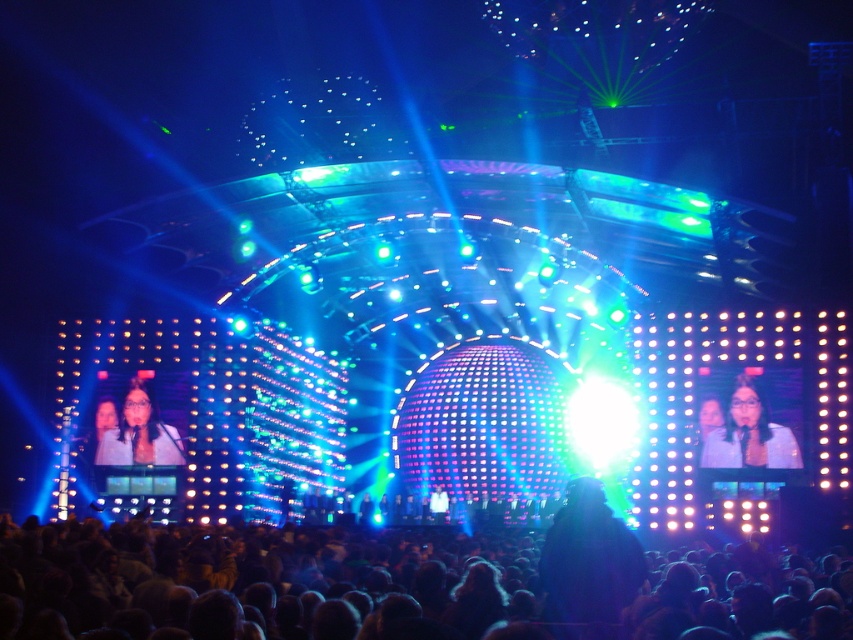
Does matte white shirt at right have a lesser width compared to matte white microphone at center?

Yes, matte white shirt at right is thinner than matte white microphone at center.

Can you confirm if matte white shirt at right is wider than matte white microphone at center?

In fact, matte white shirt at right might be narrower than matte white microphone at center.

You are a GUI agent. You are given a task and a screenshot of the screen. Output one action in this format:
    pyautogui.click(x=<x>, y=<y>)
    Task: Click on the matte white shirt at right
    The width and height of the screenshot is (853, 640).
    Given the screenshot: What is the action you would take?
    pyautogui.click(x=749, y=435)

I want to click on matte white shirt at right, so coord(749,435).

What do you see at coordinates (386, 586) in the screenshot? I see `dark hair at lower center` at bounding box center [386, 586].

Identify the location of dark hair at lower center. The height and width of the screenshot is (640, 853). (386, 586).

Does dark hair at lower center appear on the left side of matte white shirt at right?

Indeed, dark hair at lower center is positioned on the left side of matte white shirt at right.

In the scene shown: Which of these two, dark hair at lower center or matte white shirt at right, stands taller?

With more height is matte white shirt at right.

The width and height of the screenshot is (853, 640). Identify the location of dark hair at lower center. (x=386, y=586).